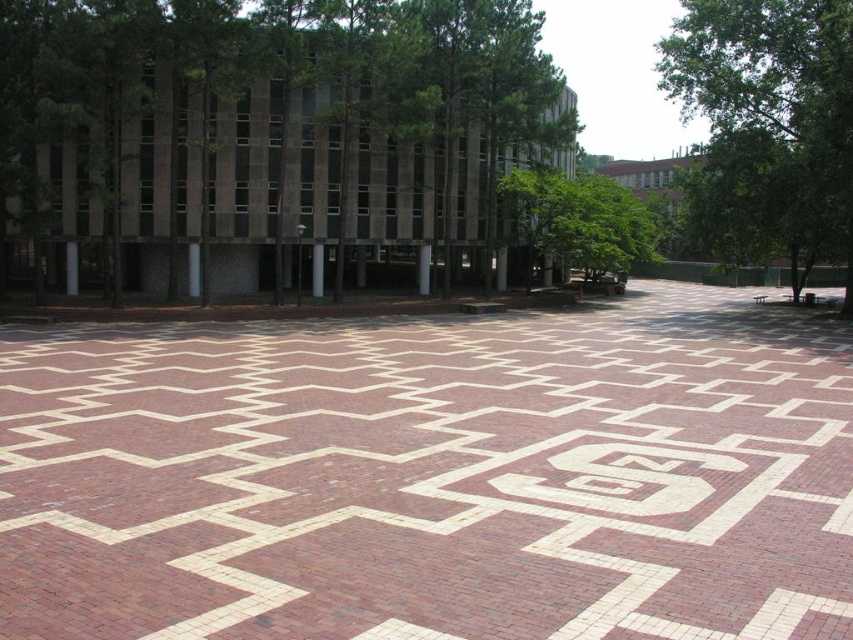
You are standing at the entrance of the plaza and want to locate the brick at center. According to the coordinates provided, where should you look in relation to the entrance?

The brick at center is located at coordinates point (432, 476), which is approximately 74.4 percent to the right and 50.8 percent down from the entrance.

You are standing at the entrance of the plaza and want to find the central emblem. According to the image, where is the brick at center located in relation to the point marked as point [432,476]?

The brick at center is exactly at the point marked as point [432,476].